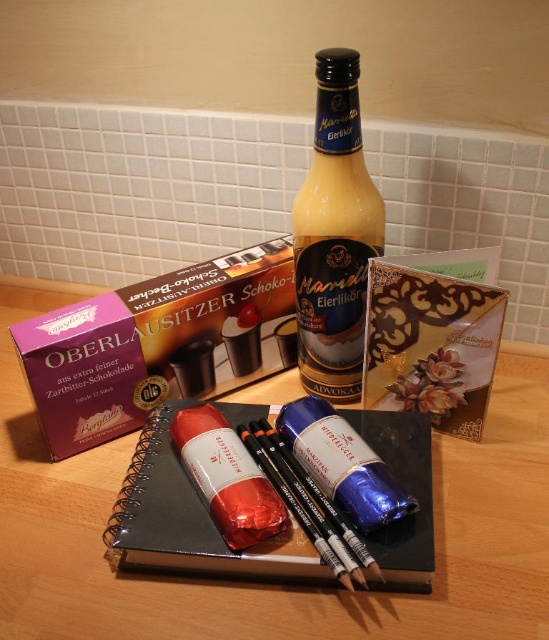
You are standing in front of the wooden surface with the Mariella Eierlikor Advokaat bottle. There are two points marked on the surface. Which point is closer to you, point (x=542, y=468) or point (x=292, y=308)?

Point (x=542, y=468) is in front of point (x=292, y=308), so it is closer to you.

You are arranging items on a wooden table at center and a black matte notebook at center. Which object is closer to you?

The wooden table at center is closer to you than the black matte notebook at center.

You are standing in front of a wooden table at center. If you want to place a book that requires 60 centimeters of space in front of you, will there be enough room?

The wooden table at center is 61.45 centimeters away from the viewer. Since the required space is 60 centimeters, there is enough room to place the book.